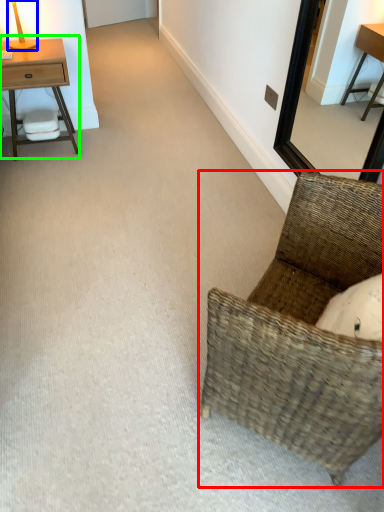
Question: Which object is the farthest from chair (highlighted by a red box)? Choose among these: table lamp (highlighted by a blue box) or nightstand (highlighted by a green box).

Choices:
 (A) table lamp
 (B) nightstand

Answer: (A)